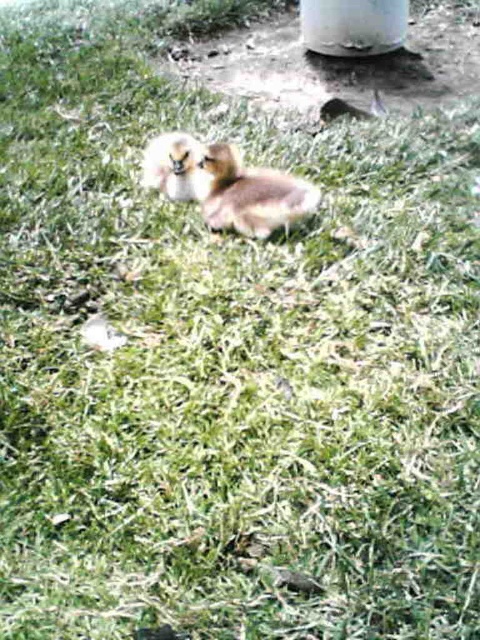
Question: Is the position of white glossy pillar at upper center more distant than that of fluffy brown duckling at center?

Choices:
 (A) no
 (B) yes

Answer: (B)

Question: Which of the following is the closest to the observer?

Choices:
 (A) brown fuzzy duckling at center
 (B) fluffy brown duckling at center
 (C) white glossy pillar at upper center

Answer: (A)

Question: Which point appears closest to the camera in this image?

Choices:
 (A) (333, 35)
 (B) (295, 193)

Answer: (B)

Question: Which object is positioned closest to the fluffy brown duckling at center?

Choices:
 (A) brown fuzzy duckling at center
 (B) white glossy pillar at upper center

Answer: (A)

Question: Where is brown fuzzy duckling at center located in relation to fluffy brown duckling at center in the image?

Choices:
 (A) left
 (B) right

Answer: (B)

Question: Observing the image, what is the correct spatial positioning of brown fuzzy duckling at center in reference to white glossy pillar at upper center?

Choices:
 (A) right
 (B) left

Answer: (B)